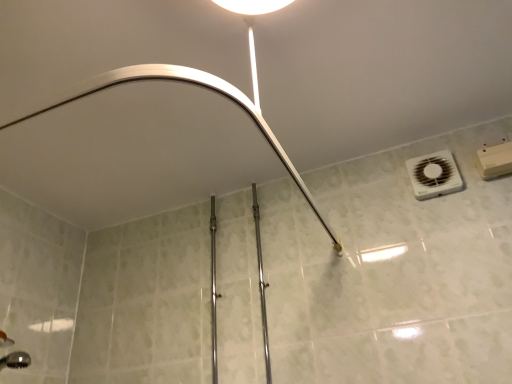
You are a GUI agent. You are given a task and a screenshot of the screen. Output one action in this format:
    pyautogui.click(x=<x>, y=<y>)
    Task: Click on the polished chrome rail at center
    The image size is (512, 384).
    Given the screenshot: What is the action you would take?
    pyautogui.click(x=261, y=284)

Find the location of a particular element. This screenshot has width=512, height=384. white plastic air conditioning at upper right is located at coordinates (434, 175).

Which is more to the left, polished chrome rail at center or matte white shower arm at upper center?

From the viewer's perspective, matte white shower arm at upper center appears more on the left side.

Considering the relative sizes of polished chrome rail at center and matte white shower arm at upper center in the image provided, is polished chrome rail at center taller than matte white shower arm at upper center?

Yes.

Identify the location of rail behind the matte white shower arm at upper center. Image resolution: width=512 pixels, height=384 pixels. (261, 284).

Does polished chrome rail at center have a smaller size compared to matte white shower arm at upper center?

Indeed, polished chrome rail at center has a smaller size compared to matte white shower arm at upper center.

Where is `air conditioning above the matte white shower arm at upper center (from a real-world perspective)`? This screenshot has width=512, height=384. air conditioning above the matte white shower arm at upper center (from a real-world perspective) is located at coordinates (434, 175).

From the image's perspective, which is below, matte white shower arm at upper center or white plastic air conditioning at upper right?

matte white shower arm at upper center, from the image's perspective.

Is matte white shower arm at upper center spatially inside white plastic air conditioning at upper right, or outside of it?

matte white shower arm at upper center cannot be found inside white plastic air conditioning at upper right.

Is matte white shower arm at upper center next to white plastic air conditioning at upper right?

No.

From a real-world perspective, is white plastic air conditioning at upper right on top of matte white shower arm at upper center?

Yes, from a real-world perspective, white plastic air conditioning at upper right is on top of matte white shower arm at upper center.

Is point (443, 181) farther from viewer compared to point (152, 77)?

Yes, it is.

Are white plastic air conditioning at upper right and matte white shower arm at upper center located far from each other?

Actually, white plastic air conditioning at upper right and matte white shower arm at upper center are a little close together.

How much distance is there between white plastic air conditioning at upper right and matte white shower arm at upper center?

white plastic air conditioning at upper right and matte white shower arm at upper center are 24.79 inches apart from each other.

Considering the sizes of objects matte white shower arm at upper center and polished chrome rail at center in the image provided, who is taller, matte white shower arm at upper center or polished chrome rail at center?

With more height is polished chrome rail at center.

From a real-world perspective, which is physically above, matte white shower arm at upper center or polished chrome rail at center?

From a 3D spatial view, matte white shower arm at upper center is above.

Find the location of `shower above the polished chrome rail at center (from the image's perspective)`. shower above the polished chrome rail at center (from the image's perspective) is located at coordinates (199, 86).

Does point (339, 247) appear closer or farther from the camera than point (266, 362)?

Point (339, 247).

Is white plastic air conditioning at upper right smaller than polished chrome rail at center?

Yes, white plastic air conditioning at upper right is smaller than polished chrome rail at center.

Can you confirm if white plastic air conditioning at upper right is thinner than polished chrome rail at center?

Correct, the width of white plastic air conditioning at upper right is less than that of polished chrome rail at center.

From a real-world perspective, is white plastic air conditioning at upper right positioned over polished chrome rail at center based on gravity?

Correct, in the physical world, white plastic air conditioning at upper right is higher than polished chrome rail at center.

Can polished chrome rail at center be found inside white plastic air conditioning at upper right?

No, polished chrome rail at center is not inside white plastic air conditioning at upper right.

From a real-world perspective, between polished chrome rail at center and white plastic air conditioning at upper right, who is vertically lower?

polished chrome rail at center is physically lower.

Considering the relative sizes of polished chrome rail at center and white plastic air conditioning at upper right in the image provided, is polished chrome rail at center wider than white plastic air conditioning at upper right?

Yes, polished chrome rail at center is wider than white plastic air conditioning at upper right.

What are the coordinates of `air conditioning on the right of polished chrome rail at center` in the screenshot? It's located at (434, 175).

Which is less distant, (261, 296) or (425, 183)?

Point (261, 296) is positioned farther from the camera compared to point (425, 183).

Locate an element on the screen. rail below the matte white shower arm at upper center (from the image's perspective) is located at coordinates (261, 284).

You are a GUI agent. You are given a task and a screenshot of the screen. Output one action in this format:
    pyautogui.click(x=<x>, y=<y>)
    Task: Click on the air conditioning above the matte white shower arm at upper center (from a real-world perspective)
    
    Given the screenshot: What is the action you would take?
    pyautogui.click(x=434, y=175)

Based on the photo, looking at the image, which one is located further to white plastic air conditioning at upper right, matte white shower arm at upper center or polished chrome rail at center?

polished chrome rail at center lies further to white plastic air conditioning at upper right than the other object.

From the picture: From the image, which object appears to be farther from matte white shower arm at upper center, white plastic air conditioning at upper right or polished chrome rail at center?

Based on the image, polished chrome rail at center appears to be further to matte white shower arm at upper center.

Looking at the image, which one is located closer to polished chrome rail at center, matte white shower arm at upper center or white plastic air conditioning at upper right?

The object closer to polished chrome rail at center is white plastic air conditioning at upper right.

From the image, which object appears to be farther from polished chrome rail at center, white plastic air conditioning at upper right or matte white shower arm at upper center?

The object further to polished chrome rail at center is matte white shower arm at upper center.

From the image, which object appears to be nearer to white plastic air conditioning at upper right, polished chrome rail at center or matte white shower arm at upper center?

Among the two, matte white shower arm at upper center is located nearer to white plastic air conditioning at upper right.

Considering their positions, is polished chrome rail at center positioned closer to matte white shower arm at upper center than white plastic air conditioning at upper right?

The object closer to matte white shower arm at upper center is white plastic air conditioning at upper right.

This screenshot has height=384, width=512. Identify the location of rail located between matte white shower arm at upper center and white plastic air conditioning at upper right in the left-right direction. (261, 284).